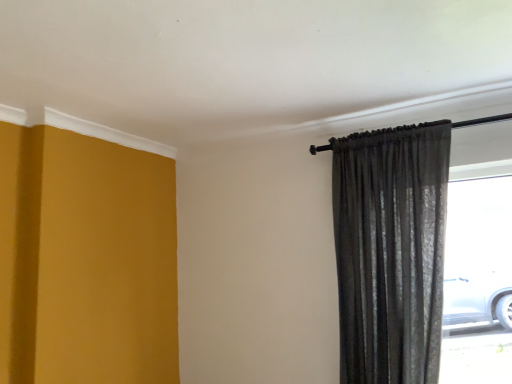
This screenshot has width=512, height=384. Identify the location of satin gray curtain at right. (390, 251).

What do you see at coordinates (390, 251) in the screenshot?
I see `satin gray curtain at right` at bounding box center [390, 251].

I want to click on satin gray curtain at right, so click(x=390, y=251).